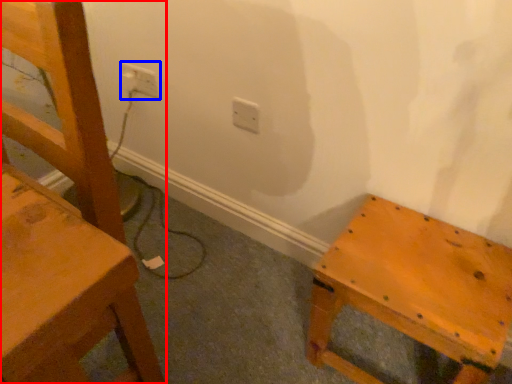
Question: Which of the following is the closest to the observer, chair (highlighted by a red box) or electric outlet (highlighted by a blue box)?

Choices:
 (A) chair
 (B) electric outlet

Answer: (A)